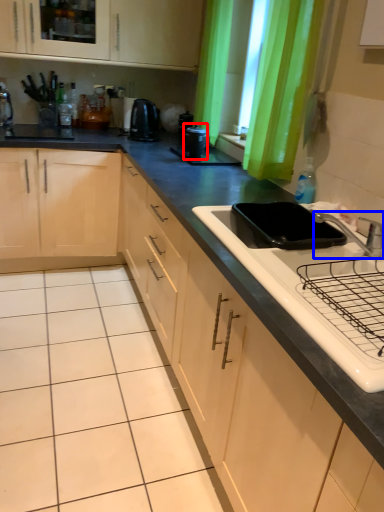
Question: Which point is closer to the camera, kitchen appliance (highlighted by a red box) or tap (highlighted by a blue box)?

Choices:
 (A) kitchen appliance
 (B) tap

Answer: (B)